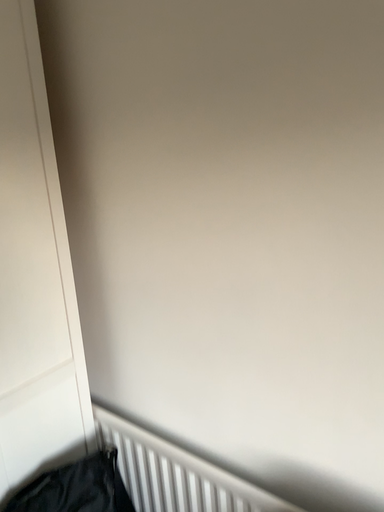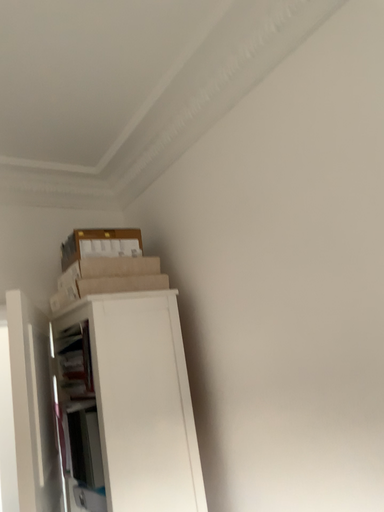
Question: Which way did the camera rotate in the video?

Choices:
 (A) rotated right
 (B) rotated left

Answer: (B)